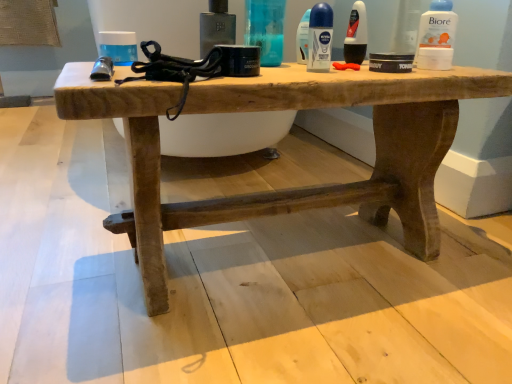
The width and height of the screenshot is (512, 384). What are the coordinates of `vacant space underneath rustic wood table at center (from a real-world perspective)` in the screenshot? It's located at (276, 250).